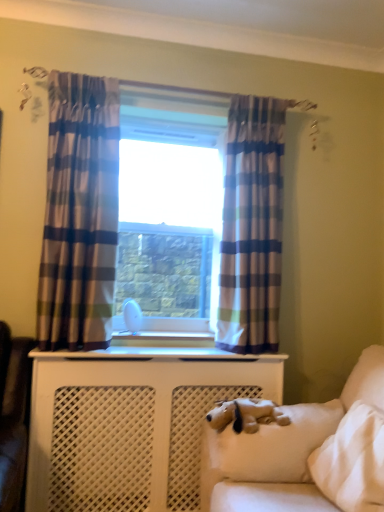
You are a GUI agent. You are given a task and a screenshot of the screen. Output one action in this format:
    pyautogui.click(x=<x>, y=<y>)
    Task: Click on the blank area beneath clear glass window at center (from a real-world perspective)
    
    Given the screenshot: What is the action you would take?
    pyautogui.click(x=168, y=333)